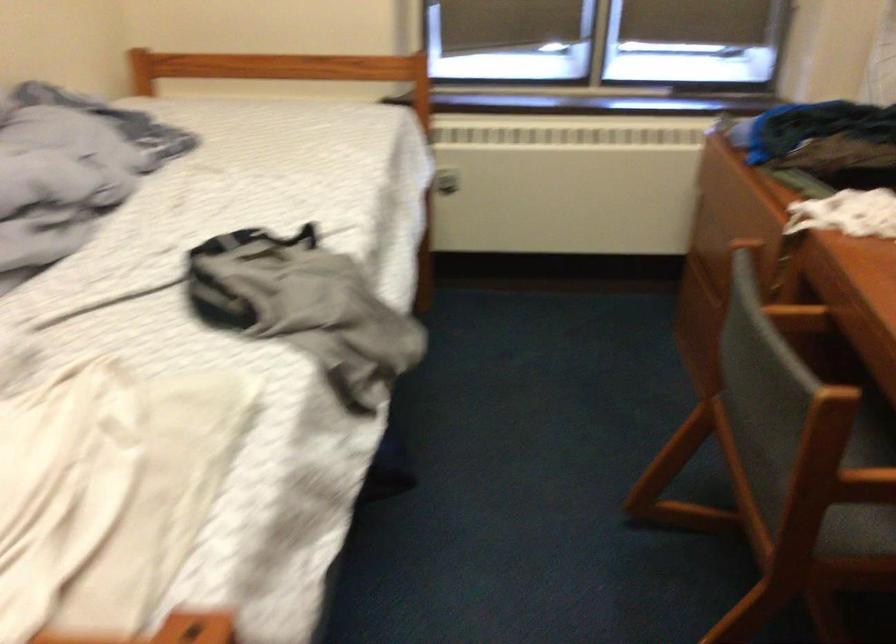
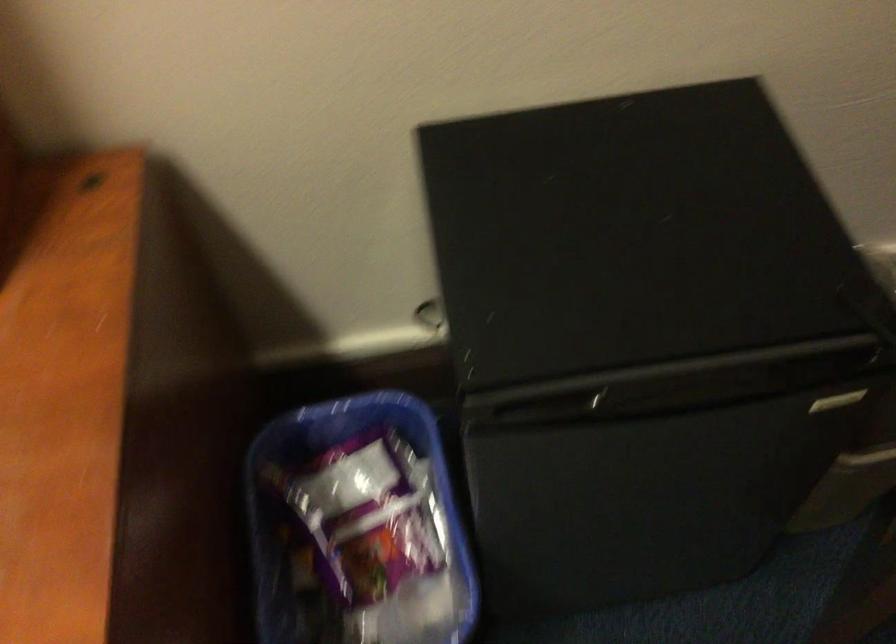
Based on the continuous images, in which direction is the camera rotating?

The camera's rotation is toward right-down.